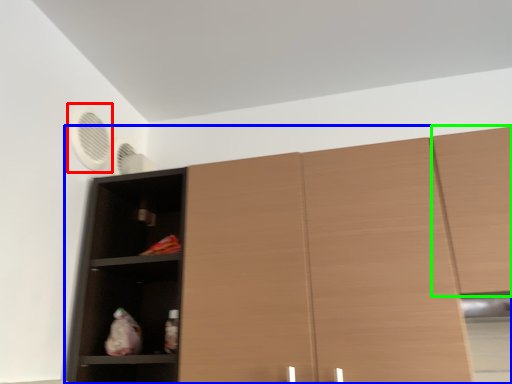
Question: Which is nearer to the fan (highlighted by a red box)? cupboard (highlighted by a blue box) or cabinetry (highlighted by a green box).

Choices:
 (A) cupboard
 (B) cabinetry

Answer: (A)